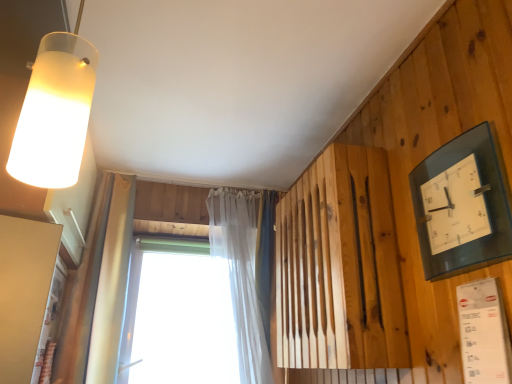
Question: Is transparent plastic window at center looking in the opposite direction of transparent glass clock at upper right?

Choices:
 (A) yes
 (B) no

Answer: (B)

Question: From a real-world perspective, is transparent plastic window at center physically above transparent glass clock at upper right?

Choices:
 (A) no
 (B) yes

Answer: (A)

Question: Is transparent plastic window at center smaller than transparent glass clock at upper right?

Choices:
 (A) yes
 (B) no

Answer: (B)

Question: Is transparent plastic window at center closer to camera compared to transparent glass clock at upper right?

Choices:
 (A) yes
 (B) no

Answer: (B)

Question: From the image's perspective, would you say transparent plastic window at center is shown under transparent glass clock at upper right?

Choices:
 (A) no
 (B) yes

Answer: (B)

Question: From their relative heights in the image, would you say frosted glass lampshade at upper left is taller or shorter than transparent plastic window at center?

Choices:
 (A) short
 (B) tall

Answer: (A)

Question: Looking at their shapes, would you say frosted glass lampshade at upper left is wider or thinner than transparent plastic window at center?

Choices:
 (A) thin
 (B) wide

Answer: (B)

Question: Is frosted glass lampshade at upper left bigger or smaller than transparent plastic window at center?

Choices:
 (A) small
 (B) big

Answer: (A)

Question: Relative to transparent plastic window at center, is frosted glass lampshade at upper left in front or behind?

Choices:
 (A) front
 (B) behind

Answer: (A)

Question: Visually, is frosted glass lampshade at upper left positioned to the left or to the right of transparent glass clock at upper right?

Choices:
 (A) right
 (B) left

Answer: (B)

Question: In terms of width, does frosted glass lampshade at upper left look wider or thinner when compared to transparent glass clock at upper right?

Choices:
 (A) thin
 (B) wide

Answer: (B)

Question: In terms of size, does frosted glass lampshade at upper left appear bigger or smaller than transparent glass clock at upper right?

Choices:
 (A) big
 (B) small

Answer: (B)

Question: From the image's perspective, relative to transparent glass clock at upper right, is frosted glass lampshade at upper left above or below?

Choices:
 (A) above
 (B) below

Answer: (A)

Question: Looking at their shapes, would you say transparent plastic window at center is wider or thinner than translucent fabric curtain at upper center?

Choices:
 (A) wide
 (B) thin

Answer: (B)

Question: From the image's perspective, is transparent plastic window at center positioned above or below translucent fabric curtain at upper center?

Choices:
 (A) above
 (B) below

Answer: (B)